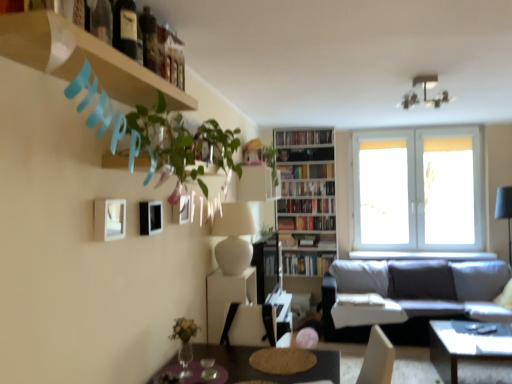
What do you see at coordinates (424, 92) in the screenshot?
I see `metallic ceiling fixture at upper center` at bounding box center [424, 92].

Describe the element at coordinates (308, 188) in the screenshot. I see `hardcover book at center, the third book positioned from the top` at that location.

Image resolution: width=512 pixels, height=384 pixels. I want to click on hardcover book at center, arranged as the first book when ordered from the bottom, so click(x=307, y=264).

Where is `white wooden bookcase at center`? white wooden bookcase at center is located at coordinates (306, 199).

The height and width of the screenshot is (384, 512). What do you see at coordinates (109, 219) in the screenshot? I see `white matte picture frame at upper left, marked as the 3th picture frame in a back-to-front arrangement` at bounding box center [109, 219].

At what (x,y) coordinates should I click in order to perform the action: click on white matte picture frame at upper left, acting as the 1th picture frame starting from the left. Please return your answer as a coordinate pair (x, y). This screenshot has width=512, height=384. Looking at the image, I should click on (109, 219).

Measure the distance between point (457, 228) and camera.

Point (457, 228) is 5.67 meters from camera.

Where is `metallic ceiling fixture at upper center`? This screenshot has height=384, width=512. metallic ceiling fixture at upper center is located at coordinates (424, 92).

The width and height of the screenshot is (512, 384). I want to click on plant that is the 3rd object to the left of the hardcover books at center, arranged as the third book when ordered from the bottom, starting at the anchor, so click(182, 141).

Which of these two, green leafy plant at upper left, which is the 1th plant in front-to-back order, or hardcover books at center, positioned as the fourth book in top-to-bottom order, is smaller?

Smaller between the two is hardcover books at center, positioned as the fourth book in top-to-bottom order.

From a real-world perspective, is green leafy plant at upper left, the first plant viewed from the left, positioned above or below hardcover books at center, arranged as the third book when ordered from the bottom?

From a real-world perspective, green leafy plant at upper left, the first plant viewed from the left, is physically above hardcover books at center, arranged as the third book when ordered from the bottom.

Considering the positions of points (236, 129) and (289, 206), is point (236, 129) farther from camera compared to point (289, 206)?

No, it is in front of (289, 206).

From a real-world perspective, which is physically below, hardcover books at upper center, which is the first book in top-to-bottom order, or shiny black coffee table at lower right?

shiny black coffee table at lower right.

Looking at the image, does hardcover books at upper center, which is the first book in top-to-bottom order, seem bigger or smaller compared to shiny black coffee table at lower right?

In the image, hardcover books at upper center, which is the first book in top-to-bottom order, appears to be smaller than shiny black coffee table at lower right.

Consider the image. From the image's perspective, is hardcover books at upper center, which is the sixth book in bottom-to-top order, on shiny black coffee table at lower right?

Yes, from the image's perspective, hardcover books at upper center, which is the sixth book in bottom-to-top order, is on top of shiny black coffee table at lower right.

Which is in front, point (282, 171) or point (99, 4)?

The point (99, 4) is in front.

Does hardcover book at center, which is counted as the second book, starting from the top, have a lesser width compared to green glass wine bottle at upper left, the first wine bottle when ordered from front to back?

No, hardcover book at center, which is counted as the second book, starting from the top, is not thinner than green glass wine bottle at upper left, the first wine bottle when ordered from front to back.

Is green glass wine bottle at upper left, the first wine bottle when ordered from front to back, located within hardcover book at center, which is counted as the second book, starting from the top?

No, hardcover book at center, which is counted as the second book, starting from the top, does not contain green glass wine bottle at upper left, the first wine bottle when ordered from front to back.

Identify the location of the 3rd wine bottle to the left when counting from the hardcover book at center, positioned as the fifth book in bottom-to-top order. The width and height of the screenshot is (512, 384). (102, 21).

Between black matte picture frame at upper left, which is the second picture frame from right to left, and wooden shelf at upper left, which one is positioned in front?

wooden shelf at upper left.

From a real-world perspective, between black matte picture frame at upper left, which is the second picture frame from right to left, and wooden shelf at upper left, who is vertically lower?

black matte picture frame at upper left, which is the second picture frame from right to left, is physically lower.

Do you think black matte picture frame at upper left, arranged as the 2th picture frame when viewed from the left, is within wooden shelf at upper left, or outside of it?

black matte picture frame at upper left, arranged as the 2th picture frame when viewed from the left, is not enclosed by wooden shelf at upper left.

From the image's perspective, is black matte picture frame at upper left, arranged as the 2th picture frame when viewed from the left, below wooden shelf at upper left?

Yes.

Is white matte picture frame at upper left, acting as the 1th picture frame starting from the left, positioned in front of white wooden bookcase at center?

Yes, it is.

From the image's perspective, starting from the white wooden bookcase at center, which picture frame is the 2nd one above? Please provide its 2D coordinates.

[(109, 219)]

Does white matte picture frame at upper left, acting as the 1th picture frame starting from the left, turn towards white wooden bookcase at center?

No, white matte picture frame at upper left, acting as the 1th picture frame starting from the left, is not oriented towards white wooden bookcase at center.

From the image's perspective, would you say white matte picture frame at upper left, which ranks as the third picture frame in right-to-left order, is positioned over white wooden bookcase at center?

Yes.

Does metallic ceiling fixture at upper center appear on the left side of green leafy plant at upper center, the 3th plant from the left?

In fact, metallic ceiling fixture at upper center is to the right of green leafy plant at upper center, the 3th plant from the left.

Is metallic ceiling fixture at upper center aimed at green leafy plant at upper center, which ranks as the first plant in back-to-front order?

No, metallic ceiling fixture at upper center is not oriented towards green leafy plant at upper center, which ranks as the first plant in back-to-front order.

From a real-world perspective, which is physically above, metallic ceiling fixture at upper center or green leafy plant at upper center, the 3th plant from the left?

From a 3D spatial view, metallic ceiling fixture at upper center is above.

Does hardcover books at upper center, which is the sixth book in bottom-to-top order, have a lesser width compared to green leafy plant at upper left, the first plant viewed from the left?

Yes, hardcover books at upper center, which is the sixth book in bottom-to-top order, is thinner than green leafy plant at upper left, the first plant viewed from the left.

Are hardcover books at upper center, which is the first book in top-to-bottom order, and green leafy plant at upper left, which ranks as the 3th plant in back-to-front order, located far from each other?

Indeed, hardcover books at upper center, which is the first book in top-to-bottom order, is not near green leafy plant at upper left, which ranks as the 3th plant in back-to-front order.

Which of these two, hardcover books at upper center, which is the first book in top-to-bottom order, or green leafy plant at upper left, the first plant viewed from the left, stands shorter?

Standing shorter between the two is hardcover books at upper center, which is the first book in top-to-bottom order.

Find the location of a particular element. the 2nd book directly above the green leafy plant at upper left, which is the 1th plant in front-to-back order (from a real-world perspective) is located at coordinates (303, 137).

The height and width of the screenshot is (384, 512). I want to click on book that is the 2nd object directly below the green leafy plant at upper left, which is the 1th plant in front-to-back order (from a real-world perspective), so click(x=305, y=205).

Where is `table on the right of hardcover books at upper center, which is the first book in top-to-bottom order`? Image resolution: width=512 pixels, height=384 pixels. table on the right of hardcover books at upper center, which is the first book in top-to-bottom order is located at coordinates (464, 346).

Based on their spatial positions, is black matte picture frame at upper left, which is the second picture frame from right to left, or white matte picture frame at upper left, marked as the 3th picture frame in a back-to-front arrangement, further from green glass wine bottle at upper left, the first wine bottle when ordered from front to back?

black matte picture frame at upper left, which is the second picture frame from right to left, is positioned further to the anchor green glass wine bottle at upper left, the first wine bottle when ordered from front to back.

In the scene shown: Based on their spatial positions, is hardcover book at center, positioned as the fifth book in bottom-to-top order, or matte black picture frame at upper center, positioned as the third picture frame in left-to-right order, further from hardcover books at upper center, which is the sixth book in bottom-to-top order?

matte black picture frame at upper center, positioned as the third picture frame in left-to-right order.

When comparing their distances from matte black picture frame at upper center, positioned as the third picture frame in left-to-right order, does white matte picture frame at upper left, arranged as the 1th picture frame when viewed from the front, or green leafy plant at upper left, which is the third plant from right to left, seem further?

white matte picture frame at upper left, arranged as the 1th picture frame when viewed from the front, is positioned further to the anchor matte black picture frame at upper center, positioned as the third picture frame in left-to-right order.

Which object lies further to the anchor point white glass window at upper right, shiny black coffee table at lower right or green glass wine bottle at upper left, acting as the third wine bottle starting from the back?

green glass wine bottle at upper left, acting as the third wine bottle starting from the back.

Which object lies nearer to the anchor point green leafy plant at upper left, the first plant viewed from the left, hardcover book at center, which is counted as the second book, starting from the top, or hardcover book at center, arranged as the first book when ordered from the bottom?

hardcover book at center, arranged as the first book when ordered from the bottom, lies closer to green leafy plant at upper left, the first plant viewed from the left, than the other object.

Based on their spatial positions, is wooden shelf at upper left or green leafy plant at upper center, the 3th plant from the left, closer to hardcover book at center, which is counted as the second book, starting from the top?

green leafy plant at upper center, the 3th plant from the left, is closer to hardcover book at center, which is counted as the second book, starting from the top.

Which object lies nearer to the anchor point hardcover book at center, which is the 6th book in top-to-bottom order, gray fabric couch at lower right or green leafy plant at upper left, the first plant viewed from the left?

gray fabric couch at lower right is positioned closer to the anchor hardcover book at center, which is the 6th book in top-to-bottom order.

Looking at the image, which one is located further to matte black picture frame at upper center, which is the 1th picture frame in back-to-front order, hardcover book at center, which ranks as the fourth book in bottom-to-top order, or metallic ceiling fixture at upper center?

Among the two, hardcover book at center, which ranks as the fourth book in bottom-to-top order, is located further to matte black picture frame at upper center, which is the 1th picture frame in back-to-front order.

Where is `lamp positioned between green glass wine bottle at upper left, acting as the third wine bottle starting from the back, and hardcover book at center, arranged as the first book when ordered from the bottom, from near to far`? The image size is (512, 384). lamp positioned between green glass wine bottle at upper left, acting as the third wine bottle starting from the back, and hardcover book at center, arranged as the first book when ordered from the bottom, from near to far is located at coordinates (424, 92).

Where is `lamp between wooden shelf at upper left and white wooden bookcase at center in the front-back direction`? Image resolution: width=512 pixels, height=384 pixels. lamp between wooden shelf at upper left and white wooden bookcase at center in the front-back direction is located at coordinates (424, 92).

You are a GUI agent. You are given a task and a screenshot of the screen. Output one action in this format:
    pyautogui.click(x=<x>, y=<y>)
    Task: Click on the studio couch positioned between green leafy plant at upper center, arranged as the 2th plant when viewed from the front, and hardcover book at center, which is the 6th book in top-to-bottom order, from near to far
    The height and width of the screenshot is (384, 512).
    Given the screenshot: What is the action you would take?
    pyautogui.click(x=411, y=293)

Image resolution: width=512 pixels, height=384 pixels. Identify the location of window between gray fabric couch at lower right and hardcover book at center, which is the 6th book in top-to-bottom order, along the z-axis. (421, 191).